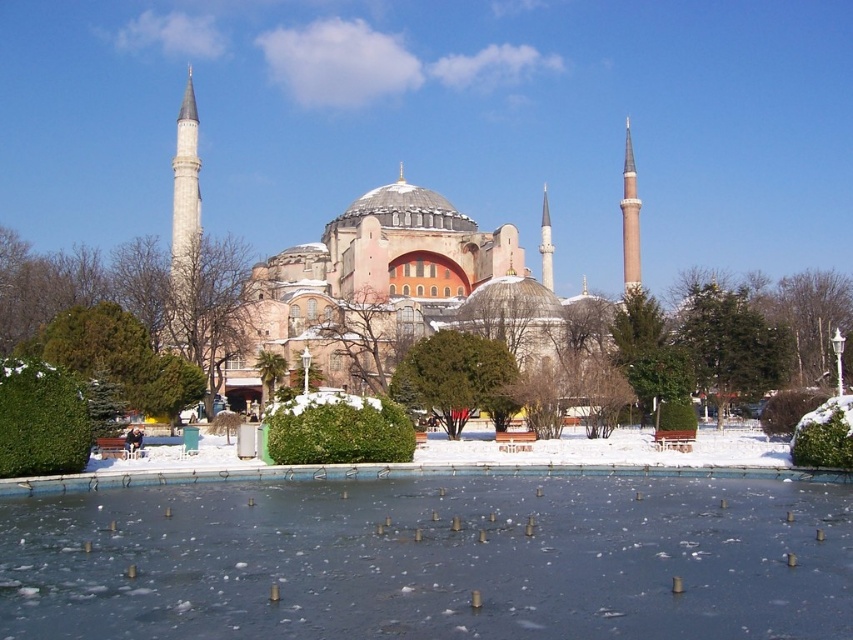
Is point (635, 214) less distant than point (544, 221)?

Yes, point (635, 214) is in front of point (544, 221).

Which is behind, point (624, 269) or point (549, 248)?

Positioned behind is point (549, 248).

Between point (631, 214) and point (550, 236), which one is positioned in front?

Positioned in front is point (631, 214).

At what (x,y) coordinates should I click in order to perform the action: click on brown stone minaret at right. Please return your answer as a coordinate pair (x, y). Looking at the image, I should click on (630, 218).

Who is higher up, frozen glass lake at center or white marble minaret at left?

white marble minaret at left is above.

Who is positioned more to the left, frozen glass lake at center or white marble minaret at left?

white marble minaret at left is more to the left.

Measure the distance between point (347, 484) and camera.

Point (347, 484) and camera are 67.18 meters apart.

Locate an element on the screen. frozen glass lake at center is located at coordinates (432, 561).

Does white marble minaret at left have a greater width compared to smooth white minaret at center?

Yes, white marble minaret at left is wider than smooth white minaret at center.

Between white marble minaret at left and smooth white minaret at center, which one is positioned higher?

Positioned higher is white marble minaret at left.

Describe the element at coordinates (184, 218) in the screenshot. I see `white marble minaret at left` at that location.

The height and width of the screenshot is (640, 853). Identify the location of white marble minaret at left. (184, 218).